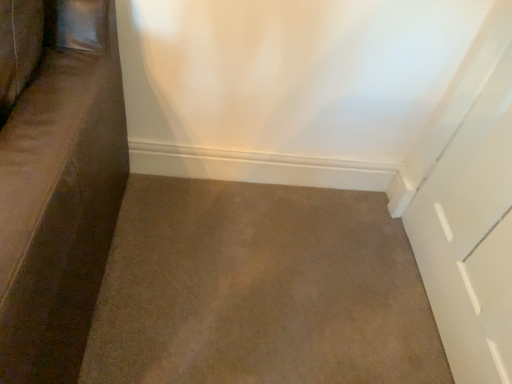
The height and width of the screenshot is (384, 512). Describe the element at coordinates (260, 289) in the screenshot. I see `brown carpet at center` at that location.

In order to click on brown carpet at center in this screenshot , I will do `click(260, 289)`.

The image size is (512, 384). I want to click on brown carpet at center, so click(x=260, y=289).